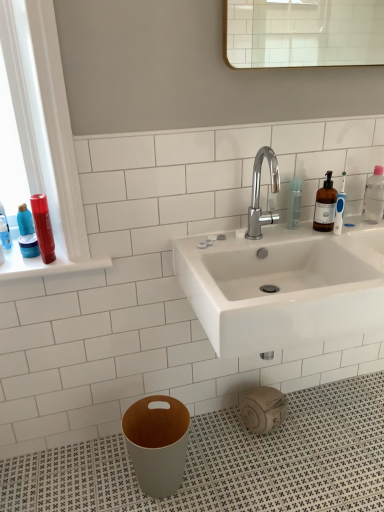
Find the location of a particular element. This screenshot has height=512, width=384. blank space to the left of shiny red hair spray at left is located at coordinates (24, 264).